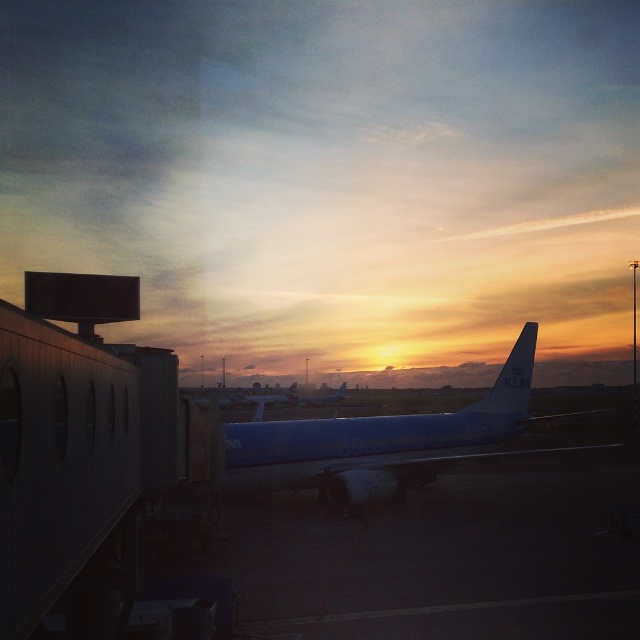
In the scene shown: Which is above, blue glossy airplane at center or blue polished airplane at center?

Positioned higher is blue glossy airplane at center.

Who is more distant from viewer, (294, 394) or (292, 403)?

Point (294, 394)

At what (x,y) coordinates should I click in order to perform the action: click on blue glossy airplane at center. Please return your answer as a coordinate pair (x, y). This screenshot has width=640, height=640. Looking at the image, I should click on click(x=269, y=401).

Based on the photo, can you confirm if blue matte airplane at center is positioned to the left of blue glossy airplane at center?

Incorrect, blue matte airplane at center is not on the left side of blue glossy airplane at center.

Between blue matte airplane at center and blue glossy airplane at center, which one has less height?

Standing shorter between the two is blue glossy airplane at center.

Between point (529, 346) and point (256, 394), which one is positioned in front?

Point (529, 346) is more forward.

Identify the location of blue matte airplane at center. (376, 442).

Is blue matte airplane at center further to camera compared to blue polished airplane at center?

No, blue matte airplane at center is closer to the viewer.

Describe the element at coordinates (376, 442) in the screenshot. Image resolution: width=640 pixels, height=640 pixels. I see `blue matte airplane at center` at that location.

Describe the element at coordinates (376, 442) in the screenshot. This screenshot has width=640, height=640. I see `blue matte airplane at center` at that location.

I want to click on blue matte airplane at center, so click(x=376, y=442).